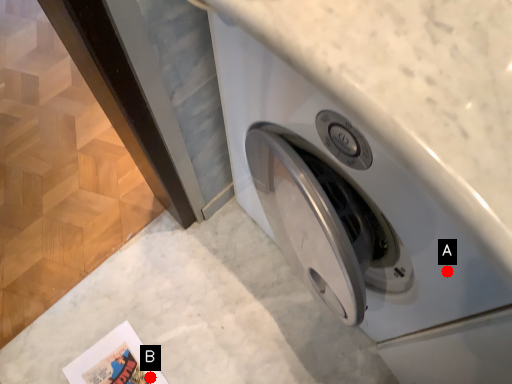
Question: Two points are circled on the image, labeled by A and B beside each circle. Which point is farther to the camera?

Choices:
 (A) A is further
 (B) B is further

Answer: (B)